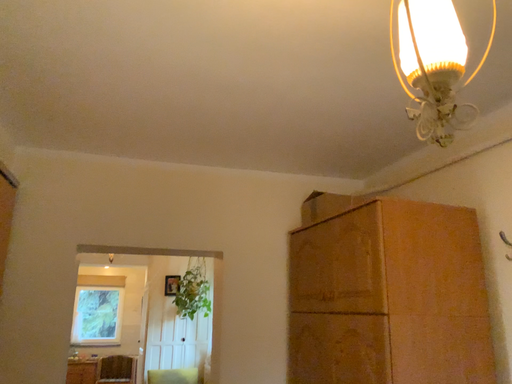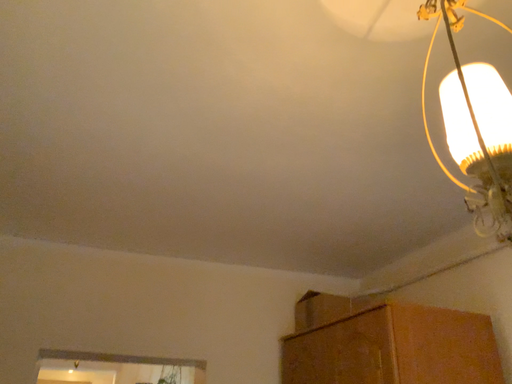
Question: How did the camera likely rotate when shooting the video?

Choices:
 (A) rotated downward
 (B) rotated upward

Answer: (B)